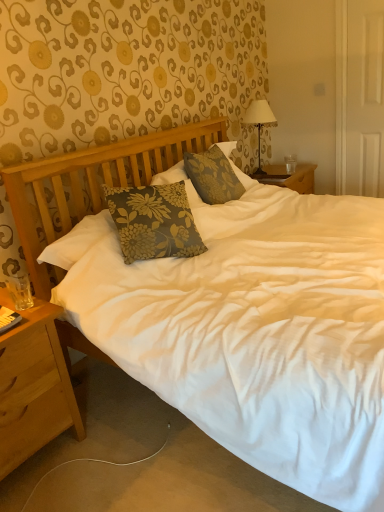
Question: Considering the relative positions of floral fabric pillow at center and light brown wood nightstand at lower left in the image provided, is floral fabric pillow at center behind light brown wood nightstand at lower left?

Choices:
 (A) no
 (B) yes

Answer: (B)

Question: Does floral fabric pillow at center have a larger size compared to light brown wood nightstand at lower left?

Choices:
 (A) yes
 (B) no

Answer: (B)

Question: Considering the relative sizes of floral fabric pillow at center and light brown wood nightstand at lower left in the image provided, is floral fabric pillow at center smaller than light brown wood nightstand at lower left?

Choices:
 (A) yes
 (B) no

Answer: (A)

Question: From the image's perspective, is floral fabric pillow at center above light brown wood nightstand at lower left?

Choices:
 (A) yes
 (B) no

Answer: (A)

Question: Can you see floral fabric pillow at center touching light brown wood nightstand at lower left?

Choices:
 (A) yes
 (B) no

Answer: (B)

Question: Is floral fabric pillow at center facing away from light brown wood nightstand at lower left?

Choices:
 (A) yes
 (B) no

Answer: (B)

Question: Is floral fabric pillow at center outside clear glass coffee cup at right?

Choices:
 (A) yes
 (B) no

Answer: (A)

Question: Does floral fabric pillow at center come in front of clear glass coffee cup at right?

Choices:
 (A) yes
 (B) no

Answer: (A)

Question: Can clear glass coffee cup at right be found inside floral fabric pillow at center?

Choices:
 (A) no
 (B) yes

Answer: (A)

Question: From a real-world perspective, is floral fabric pillow at center physically above clear glass coffee cup at right?

Choices:
 (A) yes
 (B) no

Answer: (A)

Question: From the image's perspective, does floral fabric pillow at center appear higher than clear glass coffee cup at right?

Choices:
 (A) no
 (B) yes

Answer: (A)

Question: Is floral fabric pillow at center with clear glass coffee cup at right?

Choices:
 (A) no
 (B) yes

Answer: (A)

Question: From the image's perspective, is clear glass coffee cup at right above light brown wood nightstand at lower left?

Choices:
 (A) yes
 (B) no

Answer: (A)